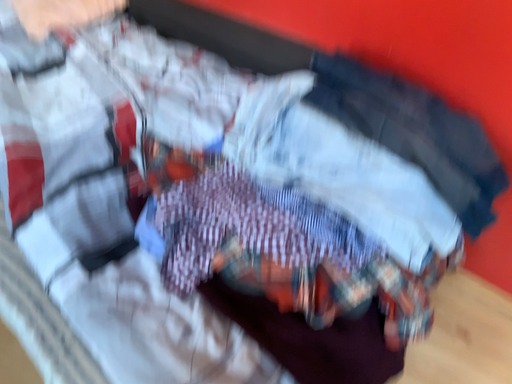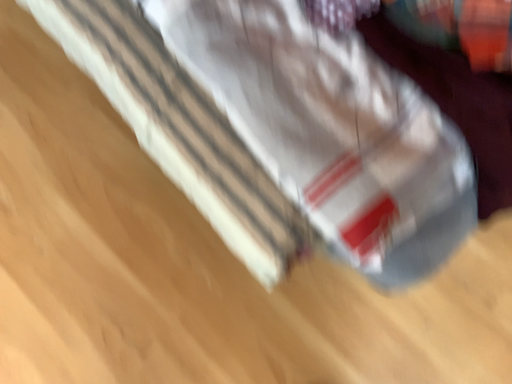
Question: How did the camera likely rotate when shooting the video?

Choices:
 (A) rotated upward
 (B) rotated downward

Answer: (B)